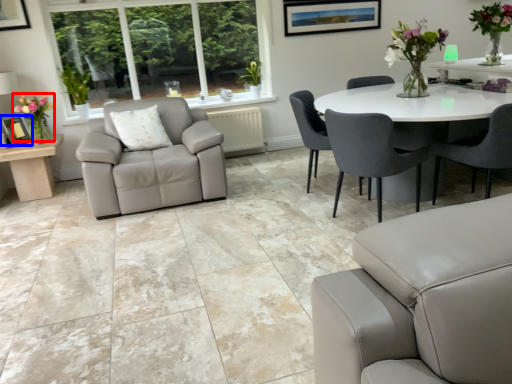
Question: Which object is closer to the camera taking this photo, floral arrangement (highlighted by a red box) or picture frame (highlighted by a blue box)?

Choices:
 (A) floral arrangement
 (B) picture frame

Answer: (A)